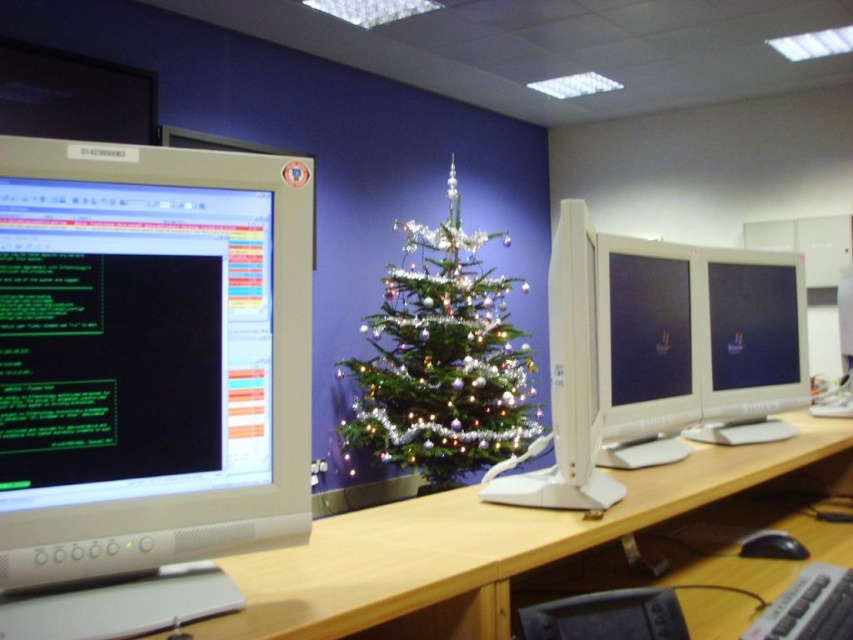
Question: Does matte white monitor at center have a lesser width compared to white glossy monitor at center right?

Choices:
 (A) yes
 (B) no

Answer: (A)

Question: Which of the following is the closest to the observer?

Choices:
 (A) (785, 536)
 (B) (577, 240)
 (C) (756, 390)
 (D) (811, 612)

Answer: (D)

Question: Which is farther from the white glossy monitor at center?

Choices:
 (A) white glossy monitor at center right
 (B) iridescent shiny christmas tree at center
 (C) wooden at center

Answer: (B)

Question: Is wooden at center to the left of white glossy monitor at center right from the viewer's perspective?

Choices:
 (A) yes
 (B) no

Answer: (A)

Question: Is matte white monitor at center below black rubber mouse at lower right?

Choices:
 (A) no
 (B) yes

Answer: (A)

Question: Among these points, which one is farthest from the camera?

Choices:
 (A) (412, 550)
 (B) (384, 320)
 (C) (566, 278)
 (D) (822, 600)

Answer: (B)